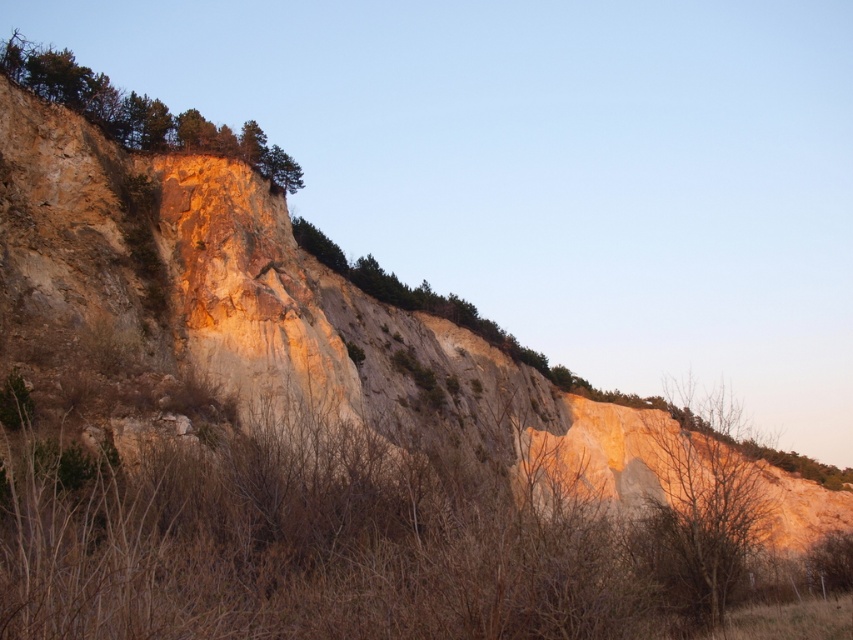
Does point (755, 492) come behind point (45, 90)?

No.

Is brown textured tree at center wider than green rough rock at upper left?

No, brown textured tree at center is not wider than green rough rock at upper left.

Is point (727, 524) positioned after point (113, 128)?

No, it is not.

Where is `brown textured tree at center`? The height and width of the screenshot is (640, 853). brown textured tree at center is located at coordinates (704, 502).